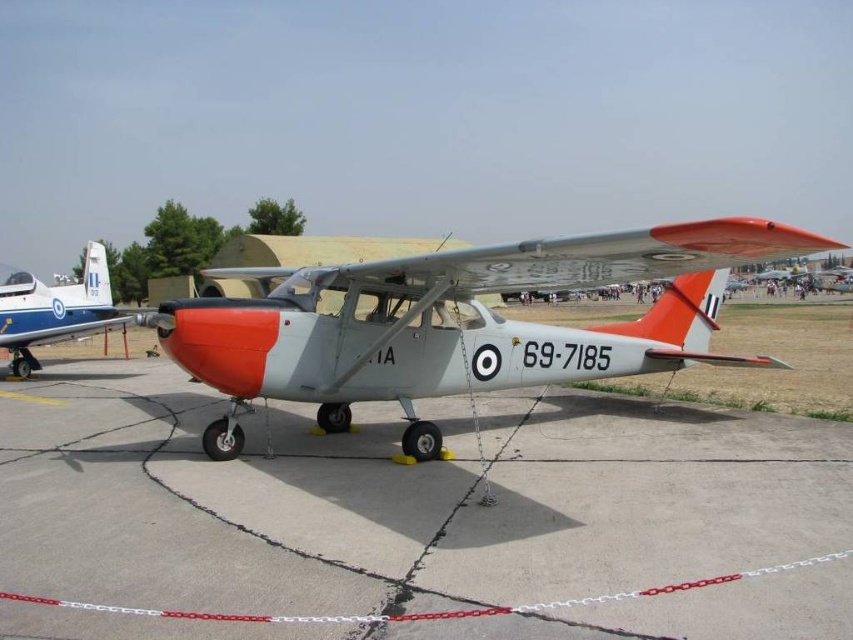
How much distance is there between gray concrete tarmac at center and matte gray airplane at center?

They are 3.67 meters apart.

Can you confirm if gray concrete tarmac at center is wider than matte gray airplane at center?

No.

What do you see at coordinates (396, 500) in the screenshot?
I see `gray concrete tarmac at center` at bounding box center [396, 500].

The width and height of the screenshot is (853, 640). I want to click on gray concrete tarmac at center, so click(x=396, y=500).

Describe the element at coordinates (459, 323) in the screenshot. I see `matte gray airplane at center` at that location.

Consider the image. Who is positioned more to the right, matte gray airplane at center or matte blue airplane at left?

matte gray airplane at center is more to the right.

Between point (393, 349) and point (38, 291), which one is positioned in front?

Positioned in front is point (393, 349).

You are a GUI agent. You are given a task and a screenshot of the screen. Output one action in this format:
    pyautogui.click(x=<x>, y=<y>)
    Task: Click on the matte gray airplane at center
    This screenshot has height=640, width=853.
    Given the screenshot: What is the action you would take?
    pos(459,323)

Between gray concrete tarmac at center and matte blue airplane at left, which one has less height?

With less height is gray concrete tarmac at center.

Based on the photo, who is positioned more to the right, gray concrete tarmac at center or matte blue airplane at left?

gray concrete tarmac at center is more to the right.

This screenshot has height=640, width=853. Describe the element at coordinates (396, 500) in the screenshot. I see `gray concrete tarmac at center` at that location.

Find the location of `gray concrete tarmac at center`. gray concrete tarmac at center is located at coordinates (396, 500).